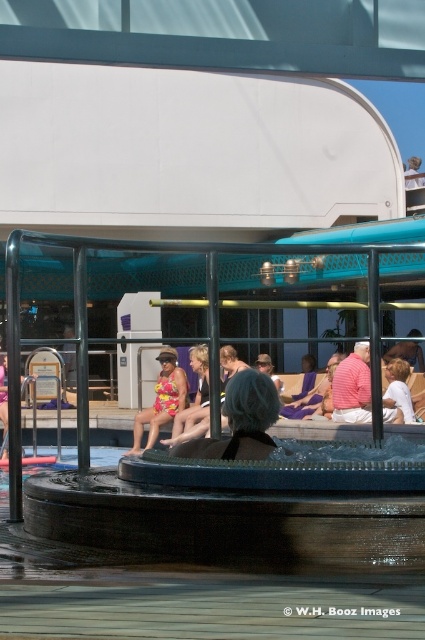
Does floral swimsuit at center appear on the right side of multicolored swimsuit at center?

In fact, floral swimsuit at center is to the left of multicolored swimsuit at center.

Which is more to the right, floral swimsuit at center or multicolored swimsuit at center?

multicolored swimsuit at center

At what (x,y) coordinates should I click in order to perform the action: click on floral swimsuit at center. Please return your answer as a coordinate pair (x, y). The width and height of the screenshot is (425, 640). Looking at the image, I should click on (161, 400).

What are the coordinates of `floral swimsuit at center` in the screenshot? It's located at (161, 400).

Which is more to the right, white fabric hat at upper center or matte yellow swimsuit at center?

white fabric hat at upper center is more to the right.

Can you confirm if white fabric hat at upper center is shorter than matte yellow swimsuit at center?

Yes, white fabric hat at upper center is shorter than matte yellow swimsuit at center.

Is point (422, 186) behind point (260, 356)?

Yes, it is behind point (260, 356).

Image resolution: width=425 pixels, height=640 pixels. What are the coordinates of `white fabric hat at upper center` in the screenshot? It's located at (413, 173).

Which is behind, point (367, 403) or point (413, 179)?

Positioned behind is point (413, 179).

Who is more distant from viewer, (362, 404) or (413, 163)?

Point (413, 163)

Where is `red shirt at center`? red shirt at center is located at coordinates (353, 387).